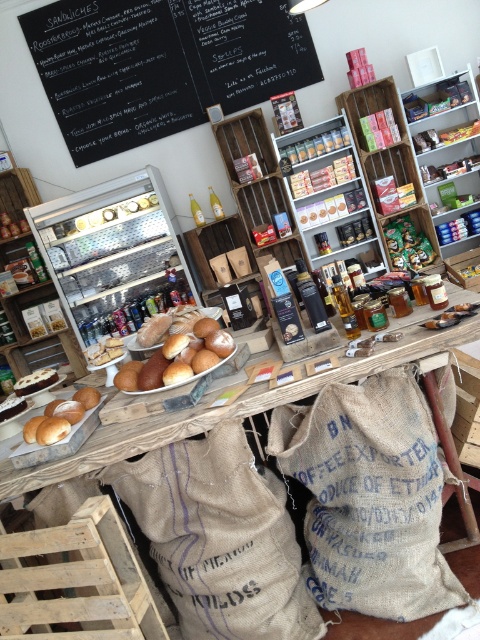
Between brown matte bread rolls at center and shiny metallic canisters at center, which one has less height?

brown matte bread rolls at center

Does brown matte bread rolls at center have a greater height compared to shiny metallic canisters at center?

Incorrect, brown matte bread rolls at center's height is not larger of shiny metallic canisters at center's.

Which is in front, point (137, 387) or point (292, 156)?

Positioned in front is point (137, 387).

The image size is (480, 640). I want to click on brown matte bread rolls at center, so click(x=179, y=358).

Can you confirm if wooden table at center is wider than shiny metallic canisters at center?

Yes, wooden table at center is wider than shiny metallic canisters at center.

Does point (382, 365) come behind point (336, 132)?

No, it is in front of (336, 132).

Locate an element on the screen. This screenshot has height=640, width=480. wooden table at center is located at coordinates (230, 406).

Does black chalkboard at upper center appear over brown matte bread rolls at center?

Yes, black chalkboard at upper center is above brown matte bread rolls at center.

Is black chalkboard at upper center positioned before brown matte bread rolls at center?

No, black chalkboard at upper center is behind brown matte bread rolls at center.

Where is `black chalkboard at upper center`? Image resolution: width=480 pixels, height=640 pixels. black chalkboard at upper center is located at coordinates (160, 65).

The height and width of the screenshot is (640, 480). Identify the location of black chalkboard at upper center. pos(160,65).